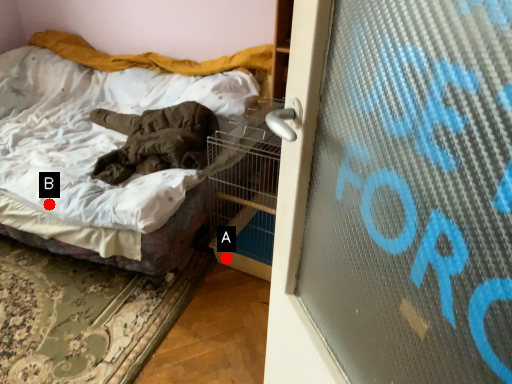
Question: Two points are circled on the image, labeled by A and B beside each circle. Which point is closer to the camera?

Choices:
 (A) A is closer
 (B) B is closer

Answer: (B)